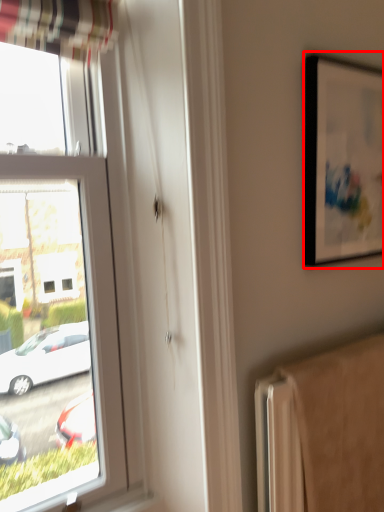
Question: From the image's perspective, where is picture frame (annotated by the red box) located in relation to radiator in the image?

Choices:
 (A) below
 (B) above

Answer: (B)